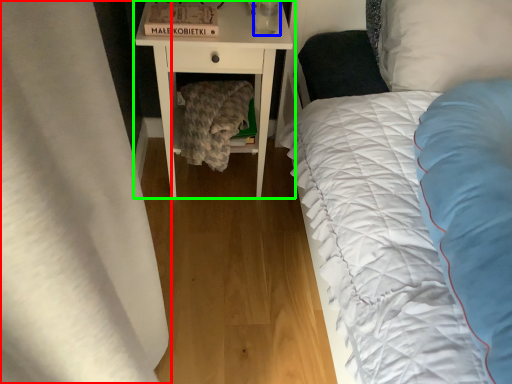
Question: Which is nearer to the curtain (highlighted by a red box)? glass vase (highlighted by a blue box) or nightstand (highlighted by a green box).

Choices:
 (A) glass vase
 (B) nightstand

Answer: (B)